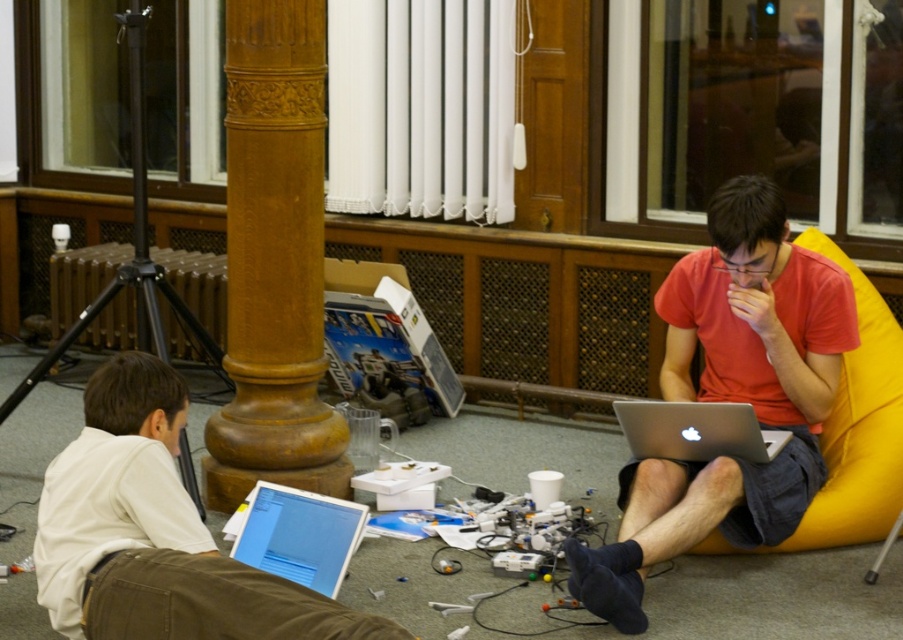
You are a photographer positioned at the entrance of the room. You want to take a photo of the silver metallic laptop at center without the yellow fabric bean bag chair at right blocking the view. Is this possible given their positions?

The silver metallic laptop at center is behind the yellow fabric bean bag chair at right, so taking a photo of the silver metallic laptop at center without the yellow fabric bean bag chair at right blocking the view would not be possible from your current position at the entrance.

You are a delivery robot that needs to place a small package between the matte red shirt at center and the silver metallic laptop at center. Can you fit the package there if it measures 10 inches in length?

The distance between the matte red shirt at center and the silver metallic laptop at center is 10.43 inches. Since the package is 10 inches long, it should fit comfortably between them with a little space to spare.